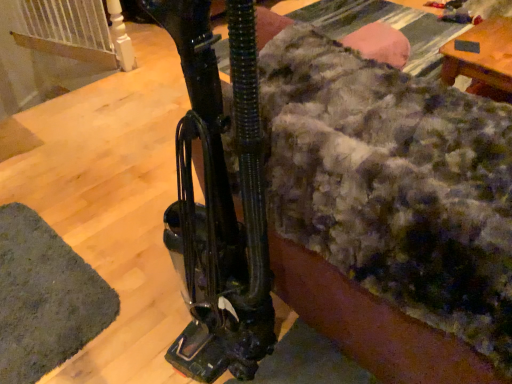
Question: Does fuzzy woolen blanket at center have a greater height compared to green fuzzy mat at lower left?

Choices:
 (A) no
 (B) yes

Answer: (B)

Question: Is the depth of fuzzy woolen blanket at center greater than that of green fuzzy mat at lower left?

Choices:
 (A) no
 (B) yes

Answer: (A)

Question: From a real-world perspective, is fuzzy woolen blanket at center under green fuzzy mat at lower left?

Choices:
 (A) no
 (B) yes

Answer: (A)

Question: Would you say fuzzy woolen blanket at center contains green fuzzy mat at lower left?

Choices:
 (A) no
 (B) yes

Answer: (A)

Question: From the image's perspective, is fuzzy woolen blanket at center beneath green fuzzy mat at lower left?

Choices:
 (A) yes
 (B) no

Answer: (B)

Question: Is fuzzy woolen blanket at center oriented away from green fuzzy mat at lower left?

Choices:
 (A) no
 (B) yes

Answer: (A)

Question: Is green fuzzy mat at lower left directly adjacent to fuzzy woolen blanket at center?

Choices:
 (A) yes
 (B) no

Answer: (B)

Question: Is green fuzzy mat at lower left thinner than fuzzy woolen blanket at center?

Choices:
 (A) yes
 (B) no

Answer: (A)

Question: From a real-world perspective, is green fuzzy mat at lower left physically below fuzzy woolen blanket at center?

Choices:
 (A) yes
 (B) no

Answer: (A)

Question: Considering the relative positions of green fuzzy mat at lower left and fuzzy woolen blanket at center in the image provided, is green fuzzy mat at lower left to the right of fuzzy woolen blanket at center from the viewer's perspective?

Choices:
 (A) no
 (B) yes

Answer: (A)

Question: Considering the relative sizes of green fuzzy mat at lower left and fuzzy woolen blanket at center in the image provided, is green fuzzy mat at lower left smaller than fuzzy woolen blanket at center?

Choices:
 (A) no
 (B) yes

Answer: (B)

Question: Does green fuzzy mat at lower left have a greater width compared to fuzzy woolen blanket at center?

Choices:
 (A) no
 (B) yes

Answer: (A)

Question: From a real-world perspective, is fuzzy woolen blanket at center above or below green fuzzy mat at lower left?

Choices:
 (A) below
 (B) above

Answer: (B)